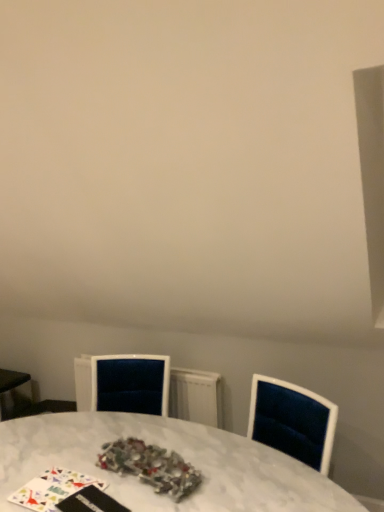
Question: Considering the relative sizes of velvet radiator at center and white marble table at center in the image provided, is velvet radiator at center shorter than white marble table at center?

Choices:
 (A) yes
 (B) no

Answer: (A)

Question: Does velvet radiator at center lie behind white marble table at center?

Choices:
 (A) no
 (B) yes

Answer: (B)

Question: From a real-world perspective, is velvet radiator at center below white marble table at center?

Choices:
 (A) no
 (B) yes

Answer: (A)

Question: Is velvet radiator at center wider than white marble table at center?

Choices:
 (A) no
 (B) yes

Answer: (A)

Question: Is velvet radiator at center bigger than white marble table at center?

Choices:
 (A) yes
 (B) no

Answer: (B)

Question: Is point (251, 504) closer or farther from the camera than point (150, 371)?

Choices:
 (A) farther
 (B) closer

Answer: (B)

Question: In the image, is white marble table at center on the left side or the right side of velvet radiator at center?

Choices:
 (A) left
 (B) right

Answer: (B)

Question: From the image's perspective, is white marble table at center positioned above or below velvet radiator at center?

Choices:
 (A) above
 (B) below

Answer: (B)

Question: From their relative heights in the image, would you say white marble table at center is taller or shorter than velvet radiator at center?

Choices:
 (A) tall
 (B) short

Answer: (A)

Question: Considering the relative positions of shiny metallic tinsel at center and white marble table at center in the image provided, is shiny metallic tinsel at center to the left or to the right of white marble table at center?

Choices:
 (A) left
 (B) right

Answer: (B)

Question: Considering the positions of shiny metallic tinsel at center and white marble table at center in the image, is shiny metallic tinsel at center wider or thinner than white marble table at center?

Choices:
 (A) thin
 (B) wide

Answer: (A)

Question: Looking at the image, does shiny metallic tinsel at center seem bigger or smaller compared to white marble table at center?

Choices:
 (A) big
 (B) small

Answer: (B)

Question: Is shiny metallic tinsel at center in front of or behind white marble table at center in the image?

Choices:
 (A) front
 (B) behind

Answer: (B)

Question: From a real-world perspective, relative to shiny metallic tinsel at center, is velvet radiator at center vertically above or below?

Choices:
 (A) above
 (B) below

Answer: (B)

Question: Is velvet radiator at center wider or thinner than shiny metallic tinsel at center?

Choices:
 (A) thin
 (B) wide

Answer: (A)